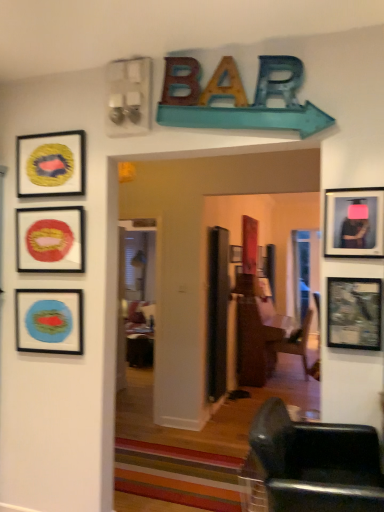
Identify the location of free location above wooden striped rug at center (from a real-world perspective). Image resolution: width=384 pixels, height=512 pixels. 175,480.